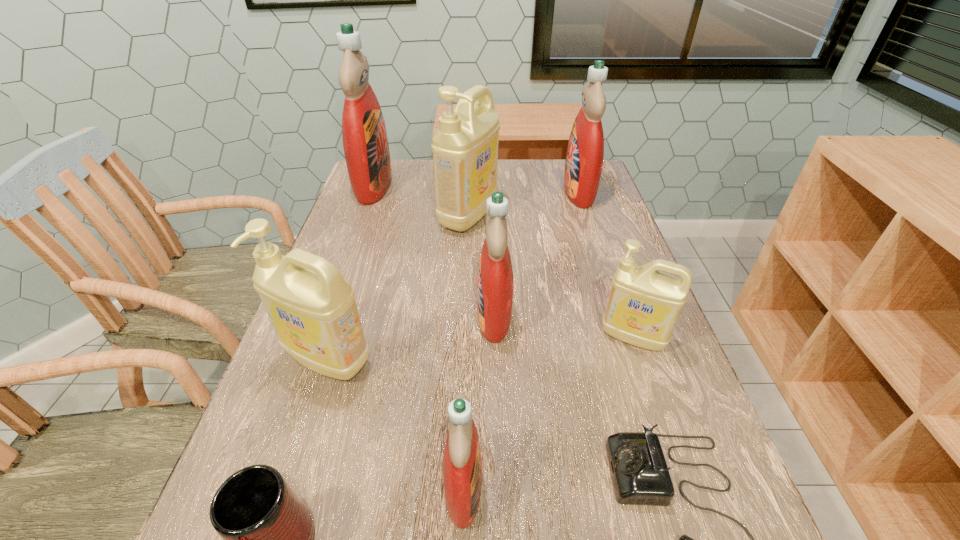
Identify the location of vacant space located 0.250m on the front surface of the tallest detergent. This screenshot has height=540, width=960. (472, 185).

The height and width of the screenshot is (540, 960). I want to click on vacant space located 0.080m on the front of the second beige detergent from right to left, so click(x=467, y=257).

Identify the location of free space located 0.090m on the front surface of the second biggest red detergent. (534, 192).

At what (x,y) coordinates should I click in order to perform the action: click on vacant point located 0.320m on the front surface of the second biggest red detergent. Please return your answer as a coordinate pair (x, y). Looking at the image, I should click on click(459, 192).

The width and height of the screenshot is (960, 540). I want to click on vacant area situated 0.380m on the front surface of the second biggest red detergent, so click(x=439, y=192).

I want to click on vacant area situated 0.220m on the front surface of the second nearest red detergent, so click(374, 316).

Where is `free location located 0.170m on the front surface of the second nearest red detergent`? The image size is (960, 540). free location located 0.170m on the front surface of the second nearest red detergent is located at coordinates [397, 316].

Where is `free space located 0.080m on the front surface of the second nearest red detergent`? Image resolution: width=960 pixels, height=540 pixels. free space located 0.080m on the front surface of the second nearest red detergent is located at coordinates (440, 316).

At what (x,y) coordinates should I click in order to perform the action: click on free space located on the back of the leftmost beige detergent. Please return your answer as a coordinate pair (x, y). Looking at the image, I should click on (372, 227).

Locate an element on the screen. The width and height of the screenshot is (960, 540). free space located 0.210m on the left of the smallest beige detergent is located at coordinates (499, 337).